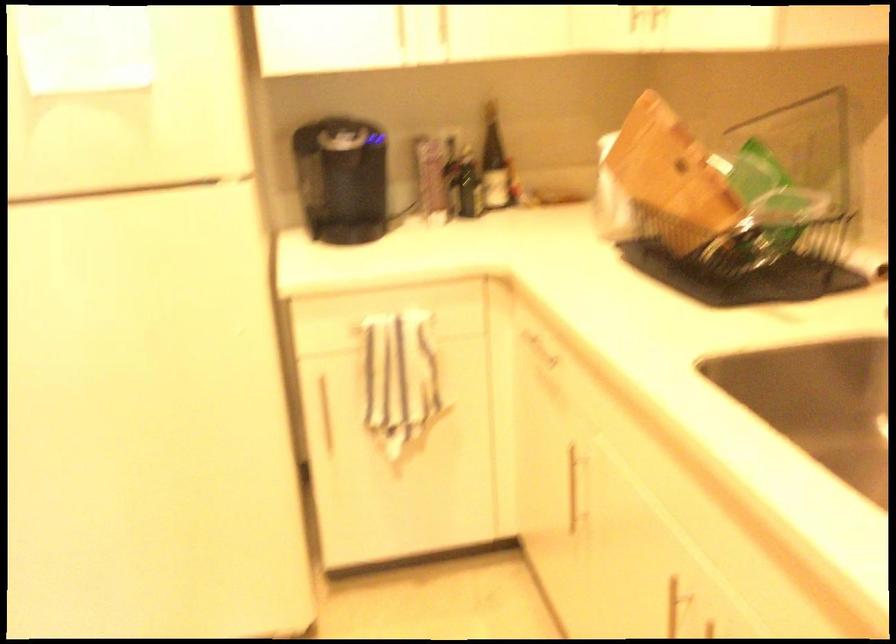
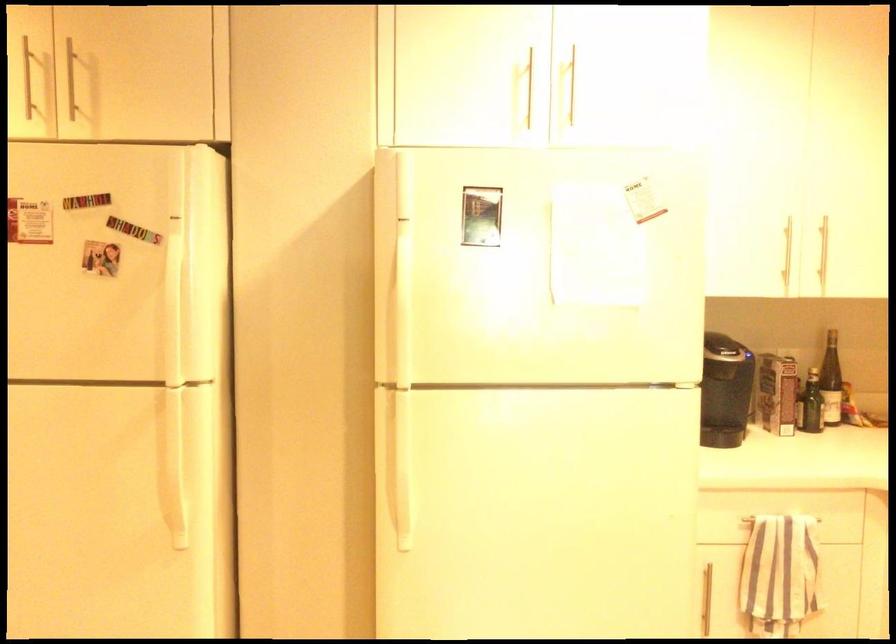
Locate, in the second image, the point that corresponds to (504,164) in the first image.

(831, 381)